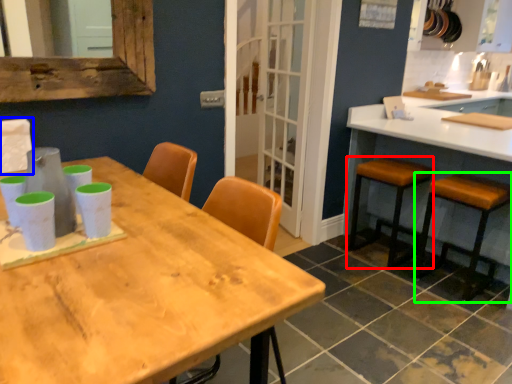
Question: Considering the real-world distances, which object is closest to stool (highlighted by a red box)? chair (highlighted by a blue box) or stool (highlighted by a green box).

Choices:
 (A) chair
 (B) stool

Answer: (B)